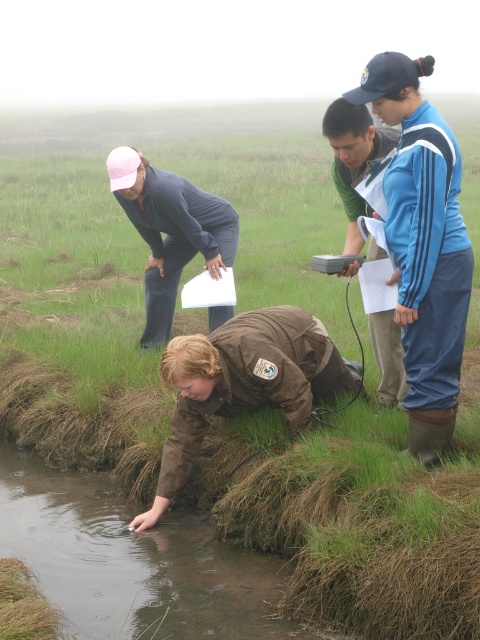
Question: Which is nearer to the green fabric jacket at center?

Choices:
 (A) brown suede jacket at lower center
 (B) matte pink cap at upper left

Answer: (A)

Question: Among these objects, which one is farthest from the camera?

Choices:
 (A) matte pink cap at upper left
 (B) brown suede jacket at lower center
 (C) green fabric jacket at center

Answer: (A)

Question: Is matte pink cap at upper left smaller than green fabric jacket at center?

Choices:
 (A) yes
 (B) no

Answer: (B)

Question: Can you confirm if matte pink cap at upper left is smaller than green fabric jacket at center?

Choices:
 (A) no
 (B) yes

Answer: (A)

Question: Which object appears farthest from the camera in this image?

Choices:
 (A) brown suede jacket at lower center
 (B) green fabric jacket at center

Answer: (A)

Question: Does brown suede jacket at lower center come behind green fabric jacket at center?

Choices:
 (A) no
 (B) yes

Answer: (B)